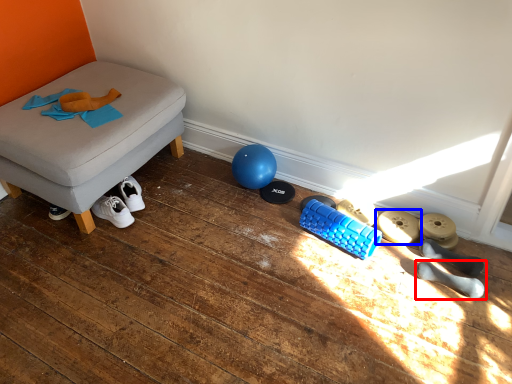
Question: Among these objects, which one is farthest to the camera, footwear (highlighted by a red box) or footwear (highlighted by a blue box)?

Choices:
 (A) footwear
 (B) footwear

Answer: (B)